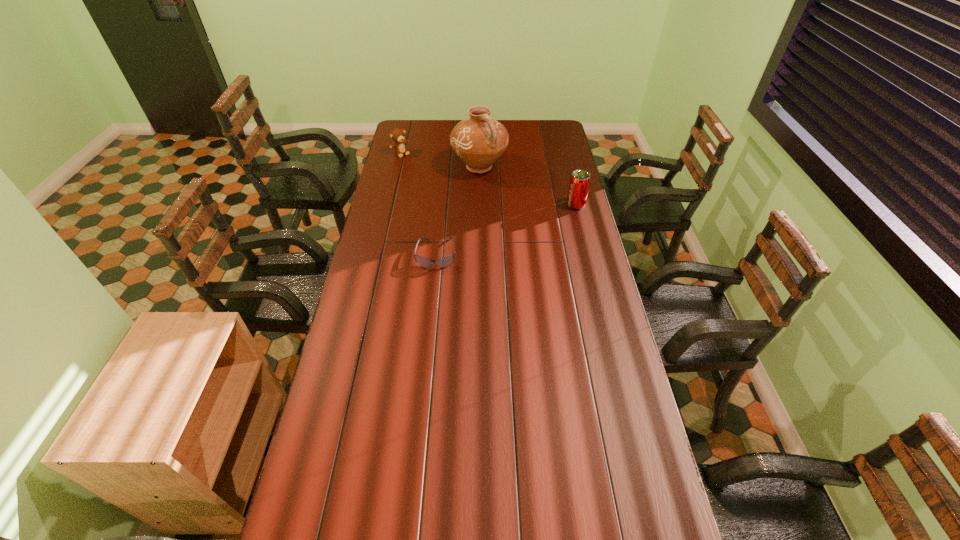
In order to click on unoccupied position between the sunglasses and the pottery in this screenshot , I will do `click(458, 210)`.

Locate an element on the screen. The height and width of the screenshot is (540, 960). free spot between the second shortest object and the tallest object is located at coordinates (440, 160).

Find the location of a particular element. Image resolution: width=960 pixels, height=540 pixels. blank region between the third shortest object and the tallest object is located at coordinates (x=528, y=186).

Identify which object is located as the second nearest to the sunglasses. Please provide its 2D coordinates. Your answer should be formatted as a tuple, i.e. [(x, y)], where the tuple contains the x and y coordinates of a point satisfying the conditions above.

[(580, 180)]

The width and height of the screenshot is (960, 540). I want to click on object that is the closest to the leftmost object, so click(479, 140).

You are a GUI agent. You are given a task and a screenshot of the screen. Output one action in this format:
    pyautogui.click(x=<x>, y=<y>)
    Task: Click on the free point that satisfies the following two spatial constraints: 1. on the front side of the second tallest object; 2. on the left side of the teddy bear
    This screenshot has height=540, width=960.
    Given the screenshot: What is the action you would take?
    pyautogui.click(x=389, y=205)

The width and height of the screenshot is (960, 540). Identify the location of free spot that satisfies the following two spatial constraints: 1. on the front side of the teddy bear; 2. on the right side of the third farthest object. (389, 205).

The width and height of the screenshot is (960, 540). I want to click on vacant space that satisfies the following two spatial constraints: 1. on the front side of the rightmost object; 2. on the right side of the leftmost object, so click(389, 205).